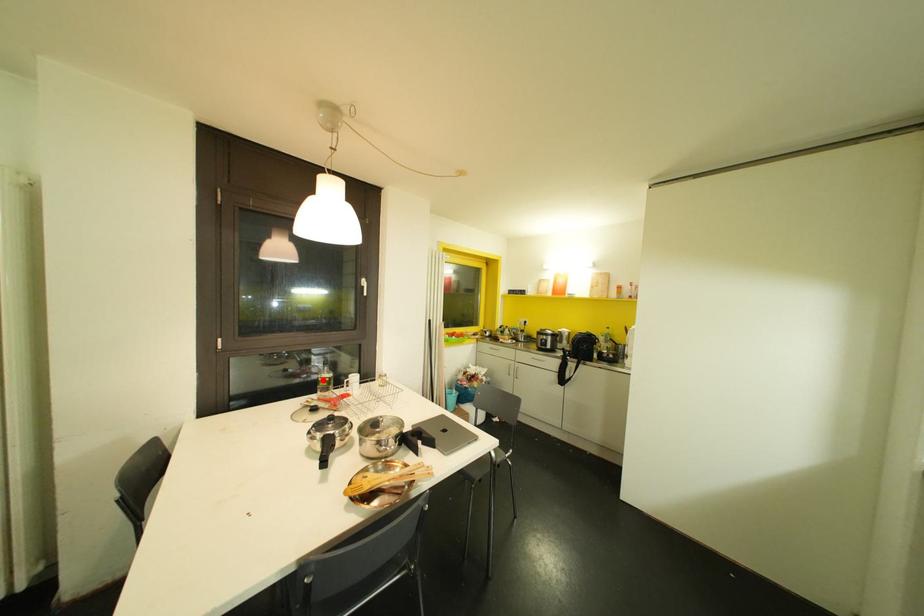
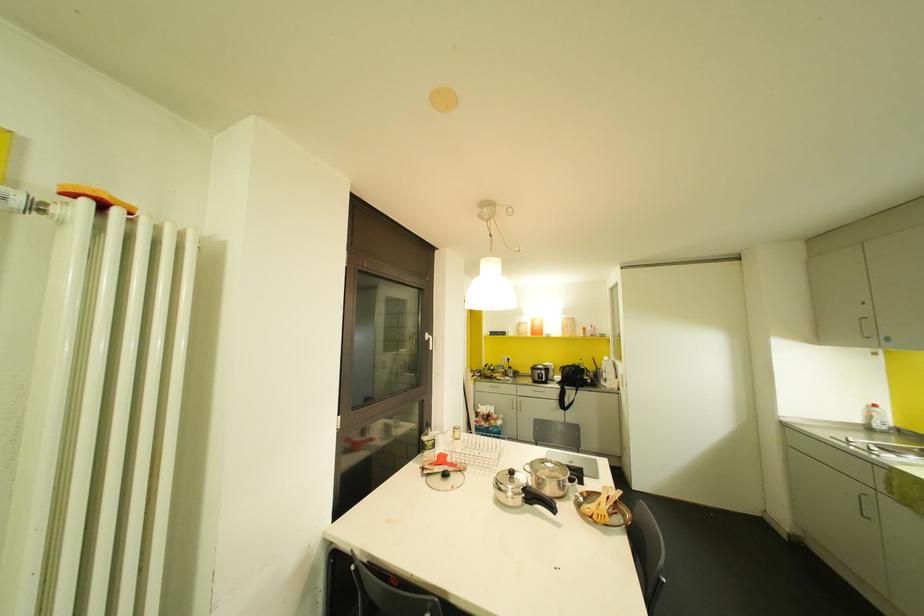
In the second image, find the point that corresponds to the highlighted location in the first image.

(429, 444)